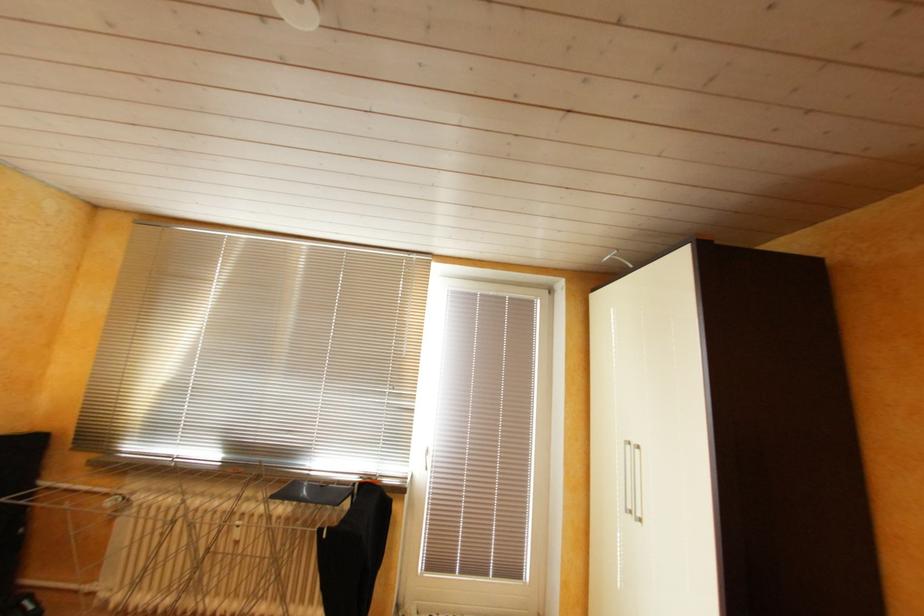
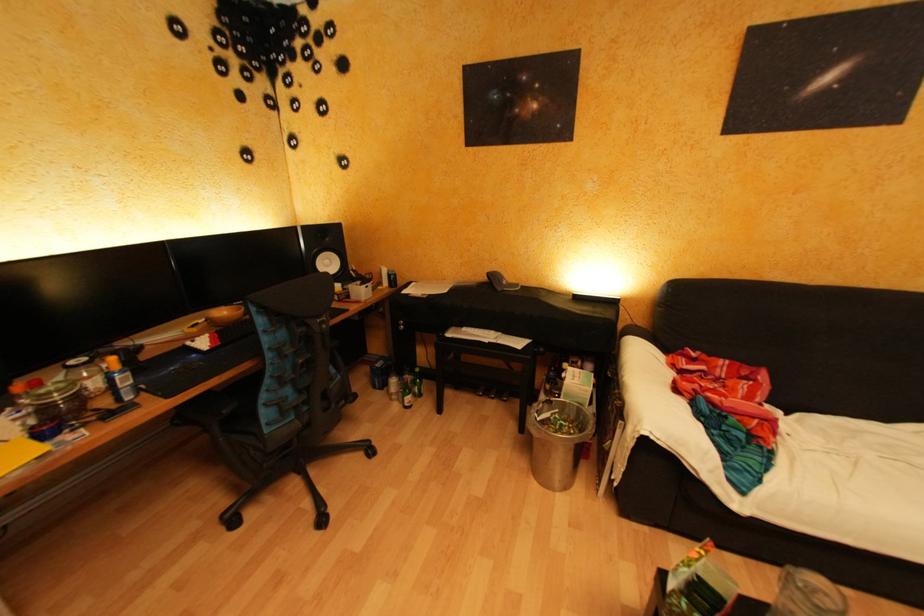
Question: The camera is either moving clockwise (left) or counter-clockwise (right) around the object. The first image is from the beginning of the video and the second image is from the end. Is the camera moving left or right when shooting the video?

Choices:
 (A) Left
 (B) Right

Answer: (B)